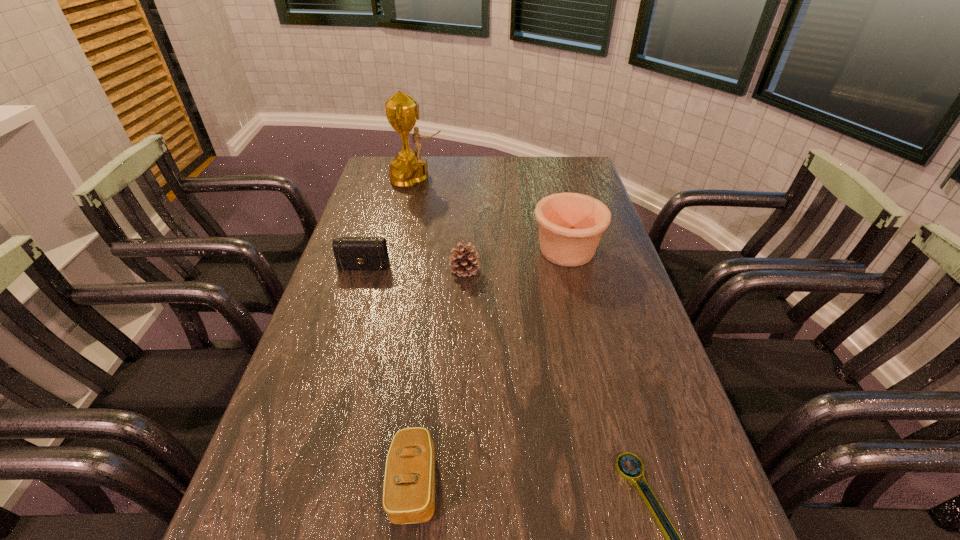
Image resolution: width=960 pixels, height=540 pixels. What are the coordinates of `free space located 0.200m on the back of the pinecone` in the screenshot? It's located at (467, 222).

Find the location of a particular element. The height and width of the screenshot is (540, 960). free space located on the front flap of the taller clutch bag is located at coordinates (349, 312).

Image resolution: width=960 pixels, height=540 pixels. In order to click on vacant space positioned on the zipper side of the nearer clutch bag in this screenshot , I will do `click(477, 483)`.

Where is `object that is at the far edge`? The width and height of the screenshot is (960, 540). object that is at the far edge is located at coordinates (408, 169).

This screenshot has height=540, width=960. I want to click on award that is at the left edge, so click(408, 169).

Find the location of `clutch bag that is at the left edge`. clutch bag that is at the left edge is located at coordinates (351, 253).

Locate an element on the screen. object that is at the right edge is located at coordinates (570, 224).

Identify the location of object at the far left corner. The image size is (960, 540). (408, 169).

In the image, there is a desktop. Find the location of `free space at the far edge`. free space at the far edge is located at coordinates (509, 181).

Find the location of a particular element. Image resolution: width=960 pixels, height=540 pixels. vacant point at the left edge is located at coordinates (324, 383).